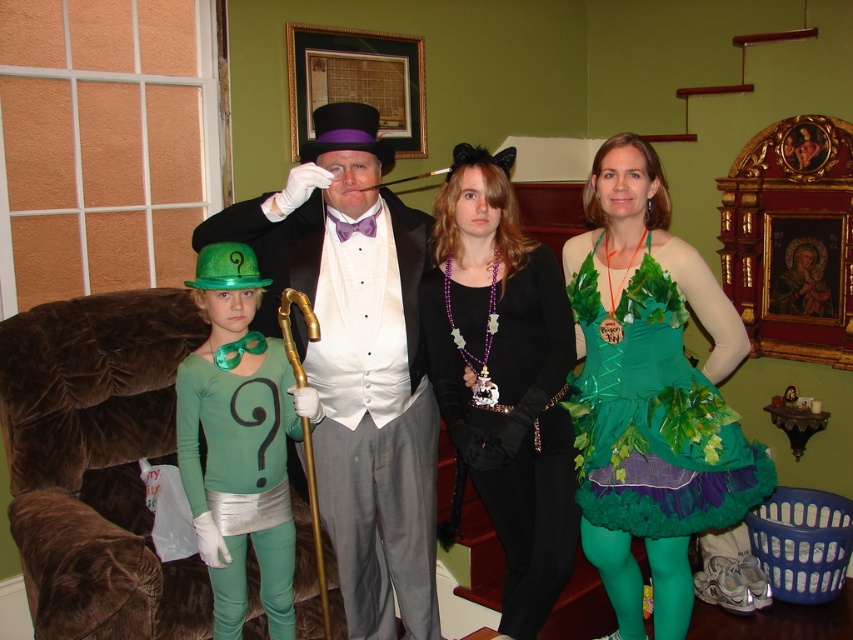
You are planning to sit between the shiny black suit at center and the green matte tights at left. Which side should you choose if you want to have more space to spread out?

You should choose the side of the shiny black suit at center because its width is larger than the green matte tights at left, providing more space to spread out.

You are organizing a costume party and need to arrange the costumes by size. Which of the two costumes, the shiny black suit at center or the green matte tights at left, should be placed first if you are arranging them from largest to smallest?

The shiny black suit at center should be placed first because it is bigger than the green matte tights at left.

You are a photographer setting up for a group photo. You need to position a light source between the green fabric dress at center and the green matte tights at left. If the light source is 12 inches wide, will it fit in the space between them?

The space between the green fabric dress at center and the green matte tights at left is 35.59 inches. Since the light source is only 12 inches wide, it will fit comfortably within that distance.